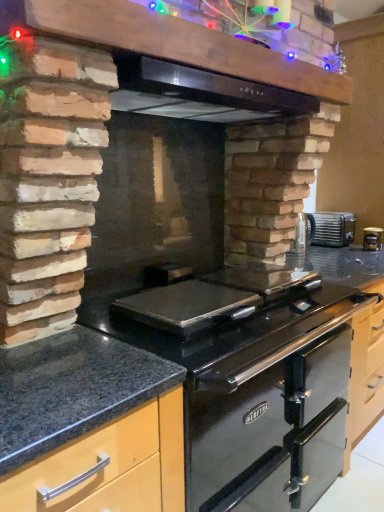
Question: Should I look upward or downward to see black stainless steel exhaust hood at upper center?

Choices:
 (A) down
 (B) up

Answer: (B)

Question: Is black stainless steel gas stove at center aimed at granite at center, which is the second countertop from right to left?

Choices:
 (A) yes
 (B) no

Answer: (B)

Question: Is granite at center, which is the second countertop from right to left, at the back of black stainless steel gas stove at center?

Choices:
 (A) no
 (B) yes

Answer: (A)

Question: Does black stainless steel gas stove at center have a greater width compared to granite at center, which is the first countertop in left-to-right order?

Choices:
 (A) yes
 (B) no

Answer: (A)

Question: From the image's perspective, does black stainless steel gas stove at center appear higher than granite at center, which is the first countertop in left-to-right order?

Choices:
 (A) yes
 (B) no

Answer: (A)

Question: Can you see black stainless steel gas stove at center touching granite at center, which is the second countertop from right to left?

Choices:
 (A) yes
 (B) no

Answer: (B)

Question: From the image's perspective, is black stainless steel gas stove at center beneath granite at center, which is the second countertop from right to left?

Choices:
 (A) yes
 (B) no

Answer: (B)

Question: From the image's perspective, is black stainless steel gas stove at center above black stainless steel exhaust hood at upper center?

Choices:
 (A) no
 (B) yes

Answer: (A)

Question: Does black stainless steel gas stove at center have a lesser height compared to black stainless steel exhaust hood at upper center?

Choices:
 (A) yes
 (B) no

Answer: (B)

Question: From the image's perspective, would you say black stainless steel gas stove at center is shown under black stainless steel exhaust hood at upper center?

Choices:
 (A) no
 (B) yes

Answer: (B)

Question: Is black stainless steel gas stove at center positioned with its back to black stainless steel exhaust hood at upper center?

Choices:
 (A) yes
 (B) no

Answer: (B)

Question: Can you confirm if black stainless steel gas stove at center is positioned to the left of black stainless steel exhaust hood at upper center?

Choices:
 (A) yes
 (B) no

Answer: (B)

Question: Considering the relative sizes of black stainless steel gas stove at center and black stainless steel exhaust hood at upper center in the image provided, is black stainless steel gas stove at center smaller than black stainless steel exhaust hood at upper center?

Choices:
 (A) yes
 (B) no

Answer: (B)

Question: Is the position of metallic black vent at upper center more distant than that of granite countertop at lower left, the 1th countertop viewed from the right?

Choices:
 (A) yes
 (B) no

Answer: (B)